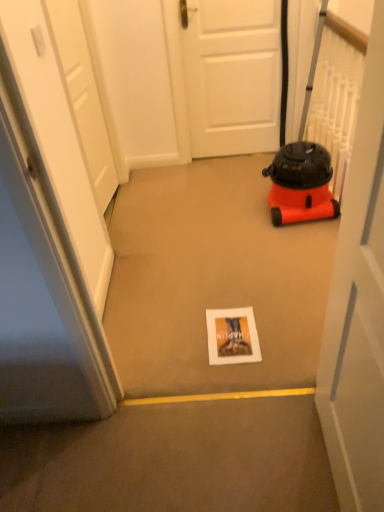
Question: Should I look upward or downward to see white matte door at center, marked as the third door in a back-to-front arrangement?

Choices:
 (A) down
 (B) up

Answer: (A)

Question: Can you confirm if white matte door at upper left, arranged as the 2th door when viewed from the front, is shorter than white matte door at center, marked as the third door in a back-to-front arrangement?

Choices:
 (A) yes
 (B) no

Answer: (B)

Question: Could you tell me if white matte door at upper left, arranged as the 2th door when viewed from the front, is facing white matte door at center, the third door viewed from the left?

Choices:
 (A) yes
 (B) no

Answer: (B)

Question: From a real-world perspective, is white matte door at upper left, the third door positioned from the right, physically below white matte door at center, marked as the third door in a back-to-front arrangement?

Choices:
 (A) yes
 (B) no

Answer: (A)

Question: Is the position of white matte door at upper left, arranged as the 2th door when viewed from the front, more distant than that of white matte door at center, the first door viewed from the front?

Choices:
 (A) yes
 (B) no

Answer: (A)

Question: Is white matte door at upper left, marked as the 2th door in a back-to-front arrangement, outside of white matte door at center, acting as the 1th door starting from the right?

Choices:
 (A) yes
 (B) no

Answer: (A)

Question: Is white matte door at upper left, the third door positioned from the right, facing away from white matte door at center, the third door viewed from the left?

Choices:
 (A) yes
 (B) no

Answer: (B)

Question: Considering the relative sizes of white matte door at upper left, the 1th door when ordered from left to right, and orange matte vacuum cleaner at right in the image provided, is white matte door at upper left, the 1th door when ordered from left to right, wider than orange matte vacuum cleaner at right?

Choices:
 (A) no
 (B) yes

Answer: (A)

Question: Would you consider white matte door at upper left, the 1th door when ordered from left to right, to be distant from orange matte vacuum cleaner at right?

Choices:
 (A) yes
 (B) no

Answer: (A)

Question: Considering the relative positions of white matte door at upper left, the third door positioned from the right, and orange matte vacuum cleaner at right in the image provided, is white matte door at upper left, the third door positioned from the right, to the left of orange matte vacuum cleaner at right from the viewer's perspective?

Choices:
 (A) yes
 (B) no

Answer: (A)

Question: From a real-world perspective, is white matte door at upper left, the third door positioned from the right, located beneath orange matte vacuum cleaner at right?

Choices:
 (A) yes
 (B) no

Answer: (A)

Question: Does white matte door at upper left, the third door positioned from the right, come behind orange matte vacuum cleaner at right?

Choices:
 (A) yes
 (B) no

Answer: (B)

Question: Is white matte door at upper left, marked as the 2th door in a back-to-front arrangement, taller than orange matte vacuum cleaner at right?

Choices:
 (A) no
 (B) yes

Answer: (B)

Question: Is white matte door at center, the first door in the back-to-front sequence, shorter than white matte door at center, marked as the third door in a back-to-front arrangement?

Choices:
 (A) no
 (B) yes

Answer: (B)